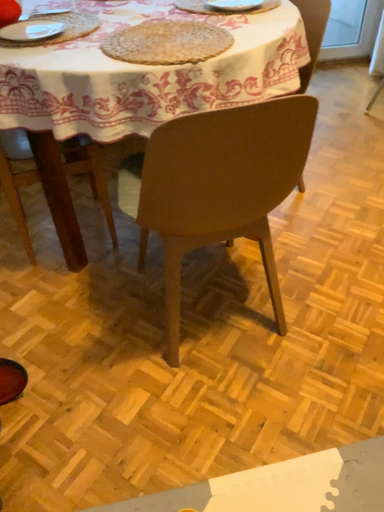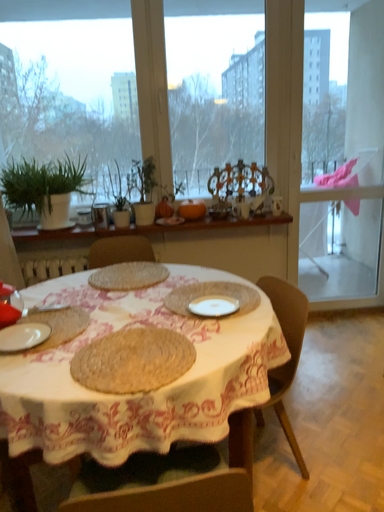
Question: Which way did the camera rotate in the video?

Choices:
 (A) rotated left
 (B) rotated right

Answer: (A)